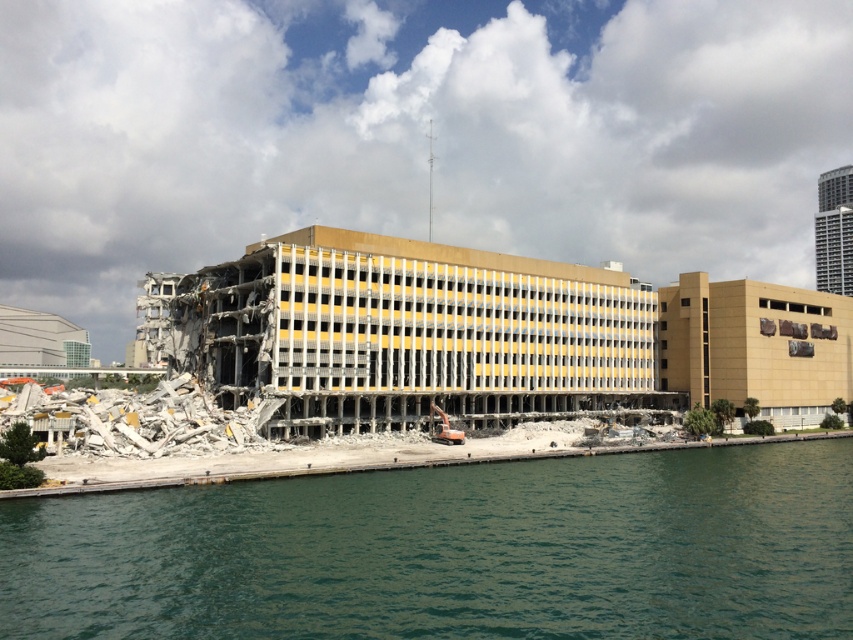
Question: Which of the following is the farthest from the observer?

Choices:
 (A) green water at lower left
 (B) concrete rubble at center

Answer: (B)

Question: Can you confirm if green water at lower left is wider than concrete rubble at center?

Choices:
 (A) yes
 (B) no

Answer: (B)

Question: Is green water at lower left above concrete rubble at center?

Choices:
 (A) no
 (B) yes

Answer: (A)

Question: Where is green water at lower left located in relation to concrete rubble at center in the image?

Choices:
 (A) left
 (B) right

Answer: (B)